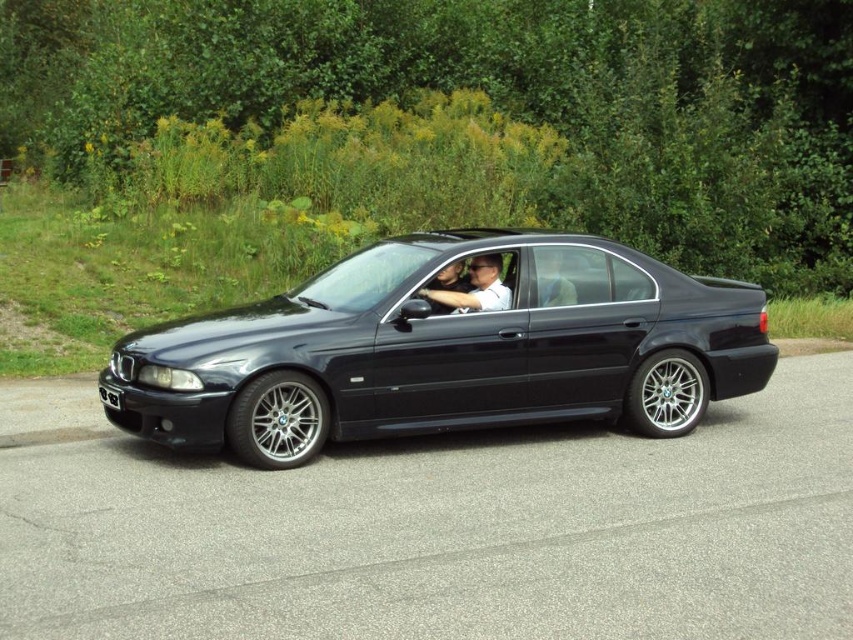
How distant is glossy black car at center from black plastic license plate at lower left?

glossy black car at center is 2.43 meters away from black plastic license plate at lower left.

Does glossy black car at center have a larger size compared to black plastic license plate at lower left?

Indeed, glossy black car at center has a larger size compared to black plastic license plate at lower left.

Between point (285, 369) and point (109, 390), which one is positioned in front?

Positioned in front is point (285, 369).

The height and width of the screenshot is (640, 853). Find the location of `glossy black car at center`. glossy black car at center is located at coordinates (444, 352).

Between matte black car at center and black plastic license plate at lower left, which one appears on the right side from the viewer's perspective?

matte black car at center is more to the right.

Can you confirm if matte black car at center is bigger than black plastic license plate at lower left?

Yes, matte black car at center is bigger than black plastic license plate at lower left.

Who is more distant from viewer, (488, 256) or (103, 390)?

The point (488, 256) is behind.

The height and width of the screenshot is (640, 853). I want to click on matte black car at center, so click(x=477, y=288).

Does glossy black car at center appear over matte black car at center?

No, glossy black car at center is not above matte black car at center.

Is glossy black car at center taller than matte black car at center?

Indeed, glossy black car at center has a greater height compared to matte black car at center.

Who is more forward, (468,328) or (482,264)?

Point (468,328) is in front.

This screenshot has width=853, height=640. In order to click on glossy black car at center in this screenshot , I will do point(444,352).